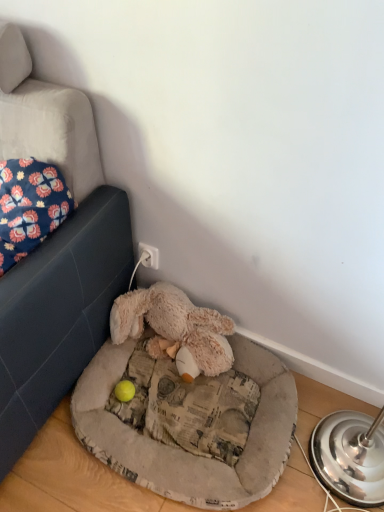
Question: From a real-world perspective, is floral fabric pillow at upper left positioned above or below fluffy beige dog bed at lower center?

Choices:
 (A) above
 (B) below

Answer: (A)

Question: Considering the positions of floral fabric pillow at upper left and fluffy beige dog bed at lower center in the image, is floral fabric pillow at upper left taller or shorter than fluffy beige dog bed at lower center?

Choices:
 (A) tall
 (B) short

Answer: (A)

Question: Which object is positioned closest to the fluffy beige dog bed at lower center?

Choices:
 (A) fluffy beige stuffed animal at lower center
 (B) floral fabric pillow at upper left

Answer: (A)

Question: Which is farther from the fluffy beige stuffed animal at lower center?

Choices:
 (A) fluffy beige dog bed at lower center
 (B) floral fabric pillow at upper left

Answer: (B)